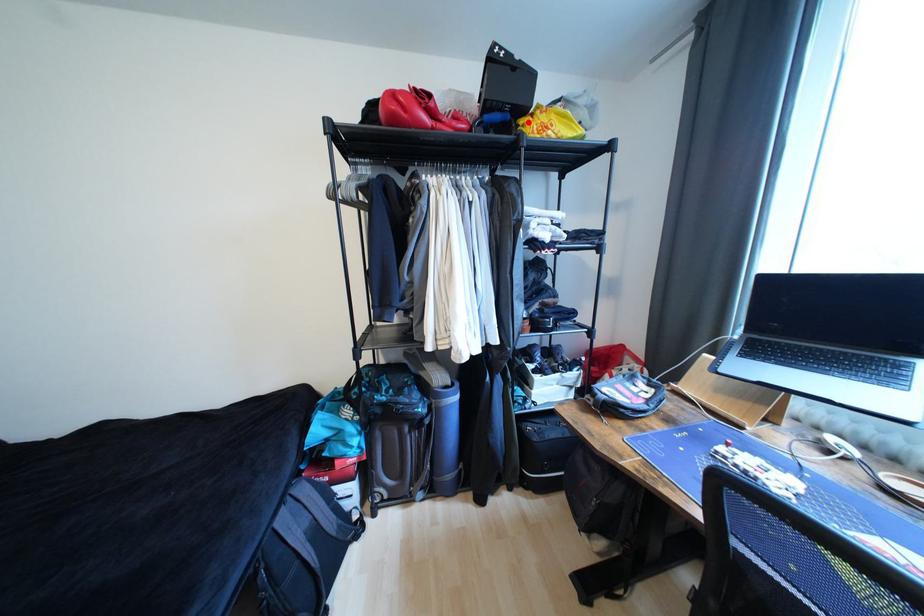
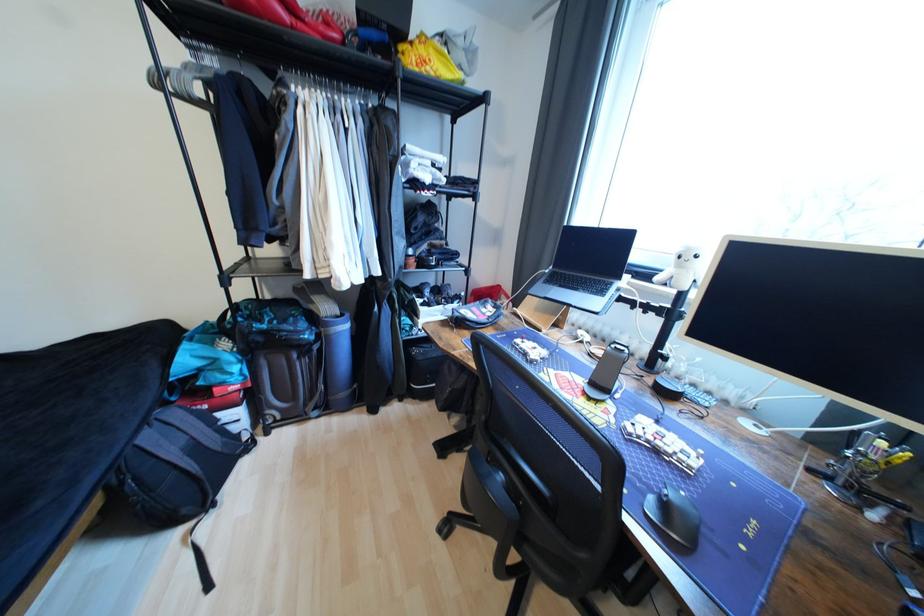
Where in the second image is the point corresponding to the highlighted location from the first image?

(407, 49)